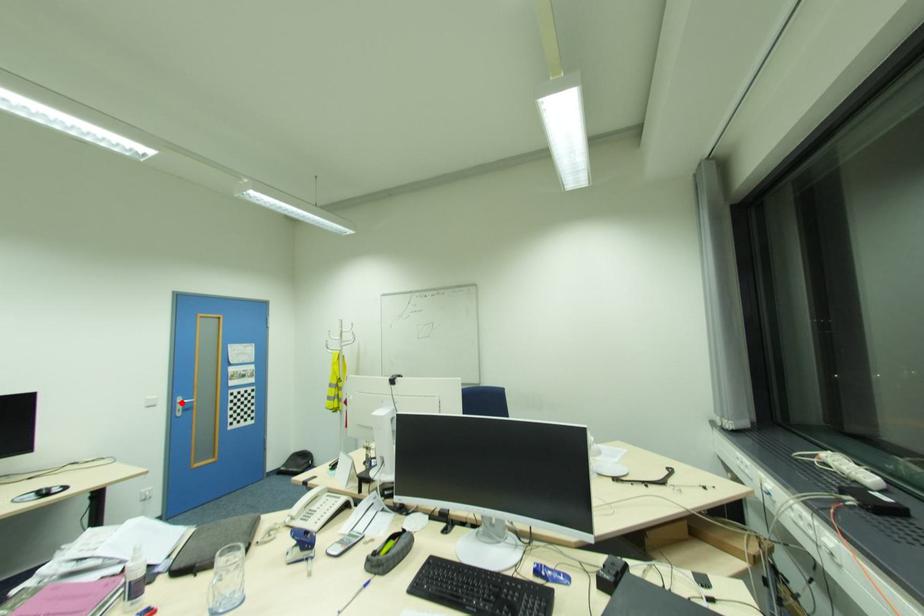
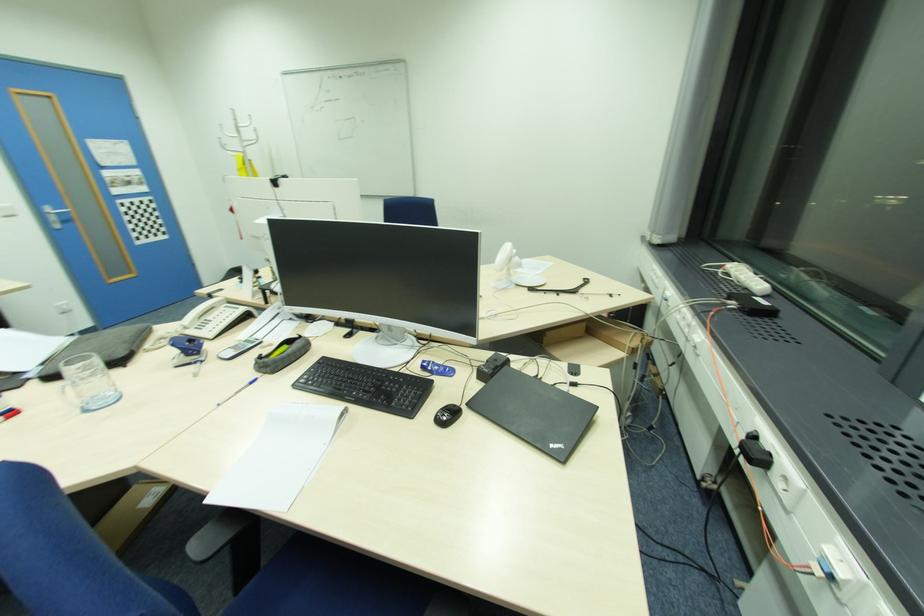
Where in the second image is the point corresponding to the highlighted location from the first image?

(54, 213)